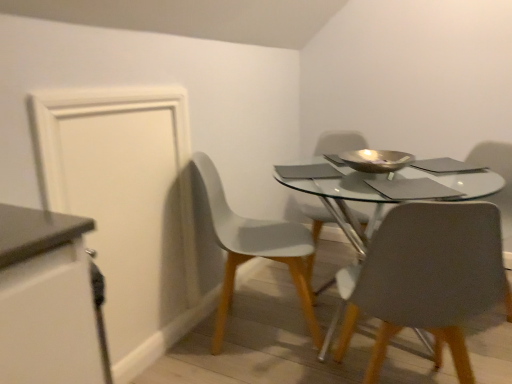
Locate an element on the screen. The image size is (512, 384). free region under white matte door at left (from a real-world perspective) is located at coordinates (155, 352).